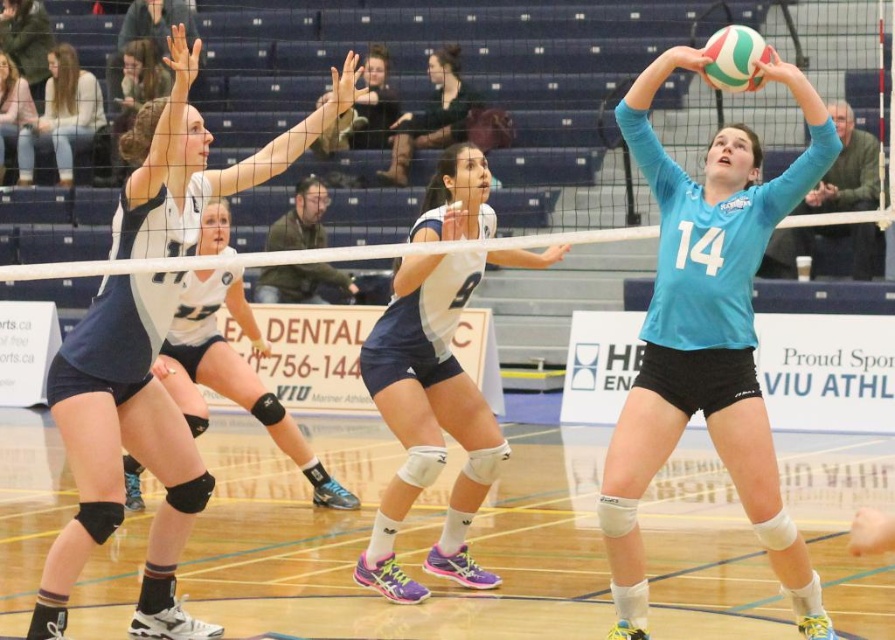
Looking at this image, you are a photographer standing at the back of the sports hall. You want to take a photo that includes both the wooden floor at center and the matte white jersey at upper left. Based on their positions, which object should you adjust your camera angle to capture first?

The wooden floor at center is to the right of the matte white jersey at upper left. To capture both in the frame, adjust your camera angle to first include the matte white jersey at upper left, then pan right to include the wooden floor at center.

You are a referee observing the volleyball game. You notice the teal matte volleyball at center and the blue jersey at center. Based on their positions, which object is closer to the net?

The teal matte volleyball at center is closer to the net because it is positioned in front of the blue jersey at center.